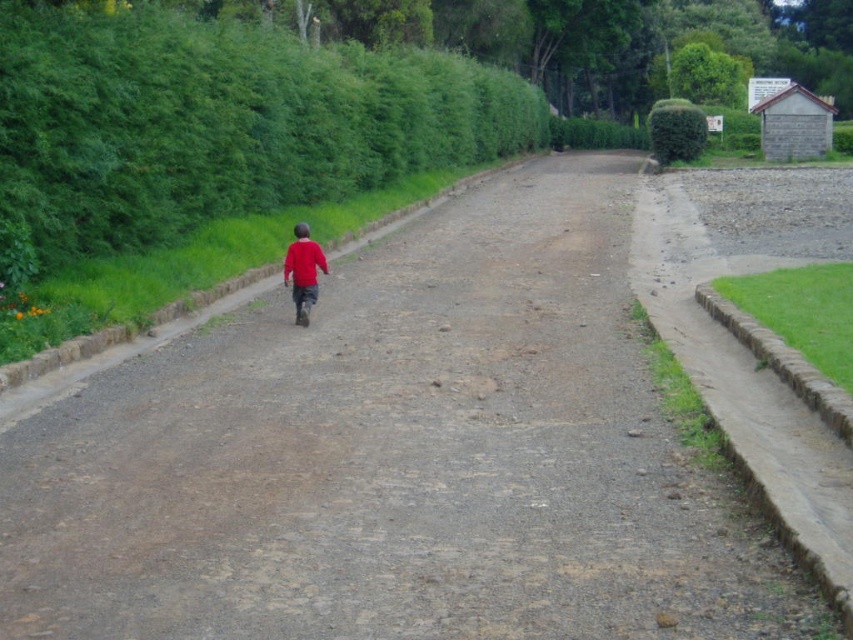
Question: Among these points, which one is farthest from the camera?

Choices:
 (A) (183, 44)
 (B) (318, 252)

Answer: (A)

Question: Estimate the real-world distances between objects in this image. Which object is closer to the red matte shirt at center?

Choices:
 (A) green leafy hedge at upper left
 (B) green leafy hedge at upper right

Answer: (A)

Question: Can you confirm if green leafy hedge at upper left is bigger than red matte shirt at center?

Choices:
 (A) yes
 (B) no

Answer: (A)

Question: Which point is farther to the camera?

Choices:
 (A) (294, 280)
 (B) (402, 67)
 (C) (672, 150)

Answer: (C)

Question: Is green leafy hedge at upper left behind green leafy hedge at upper right?

Choices:
 (A) yes
 (B) no

Answer: (B)

Question: Does green leafy hedge at upper left have a greater width compared to red matte shirt at center?

Choices:
 (A) no
 (B) yes

Answer: (B)